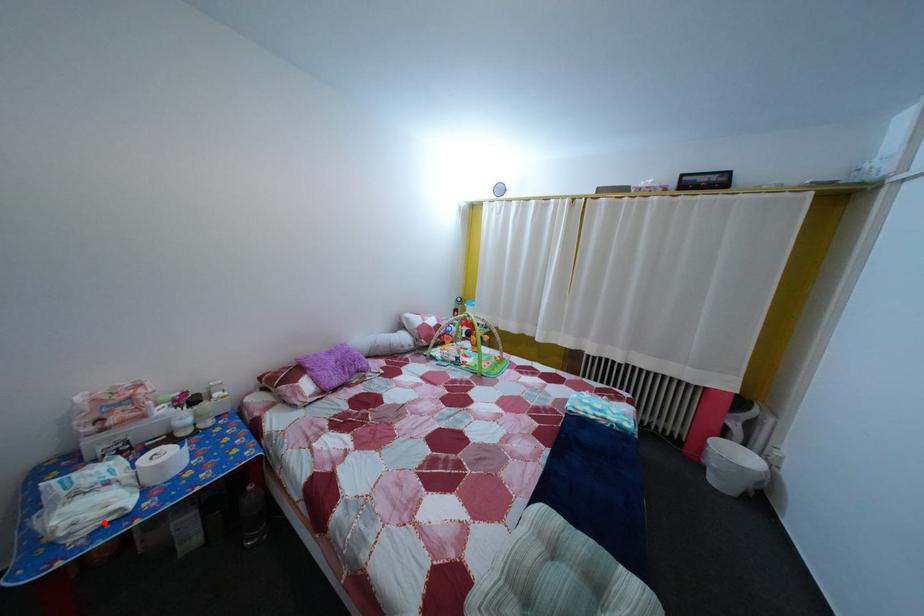
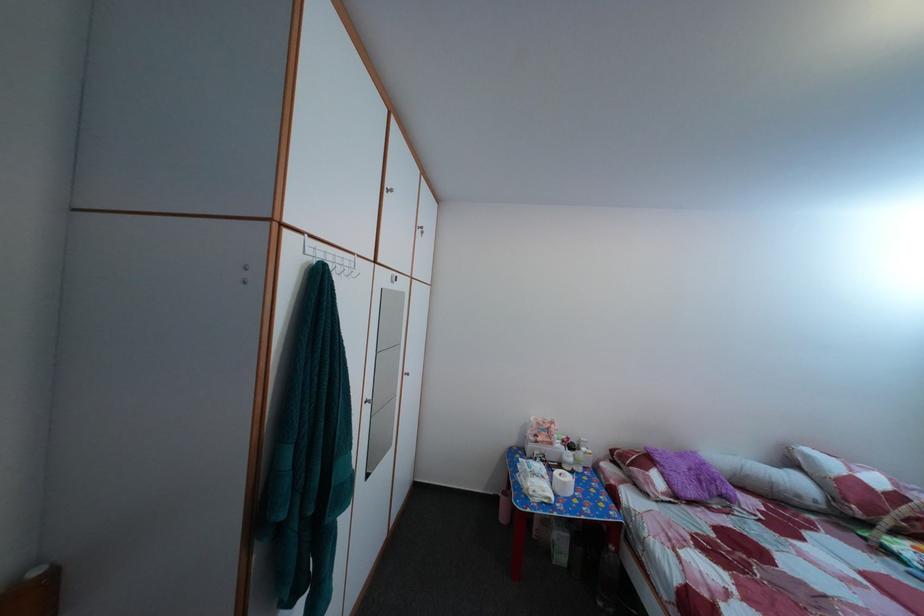
Question: I am providing you with two images of the same scene from different viewpoints. A red point is shown in image1. For the corresponding object point in image2, is it positioned nearer or farther from the camera?

Choices:
 (A) Nearer
 (B) Farther

Answer: (B)